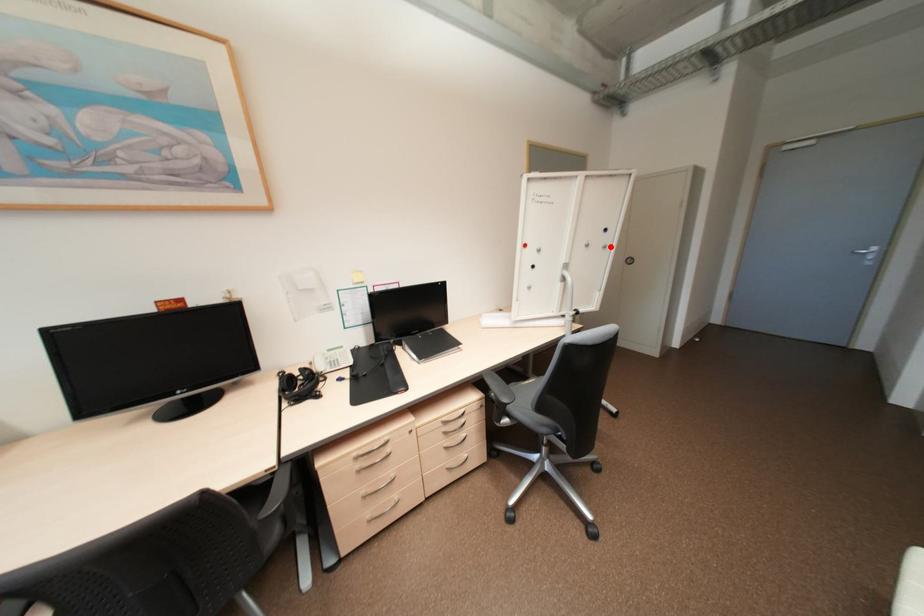
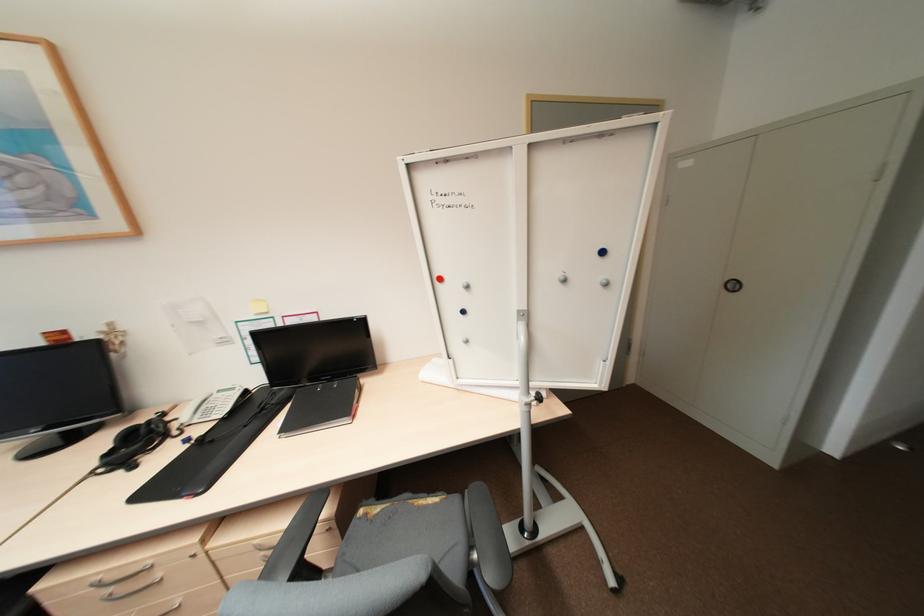
Find the pixel in the second image that matches the highlighted location in the first image.

(612, 284)